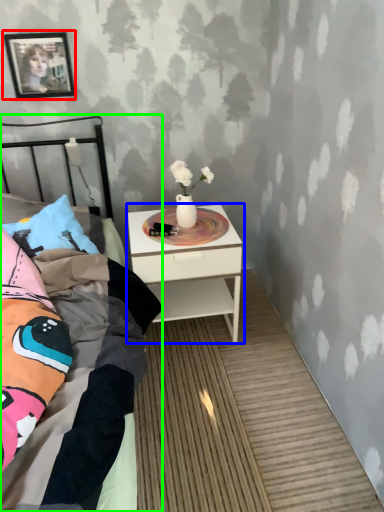
Question: Estimate the real-world distances between objects in this image. Which object is farther from picture frame (highlighted by a red box), nightstand (highlighted by a blue box) or bed (highlighted by a green box)?

Choices:
 (A) nightstand
 (B) bed

Answer: (B)